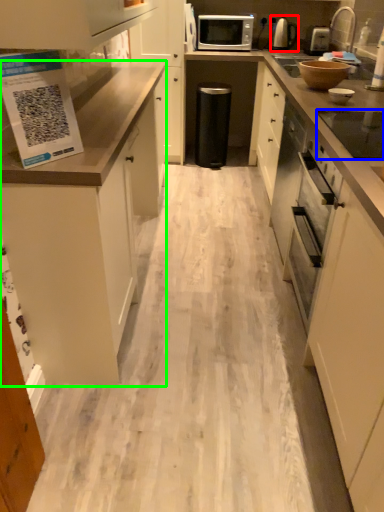
Question: Considering the real-world distances, which object is closest to kitchen appliance (highlighted by a red box)? appliance (highlighted by a blue box) or cabinetry (highlighted by a green box).

Choices:
 (A) appliance
 (B) cabinetry

Answer: (B)